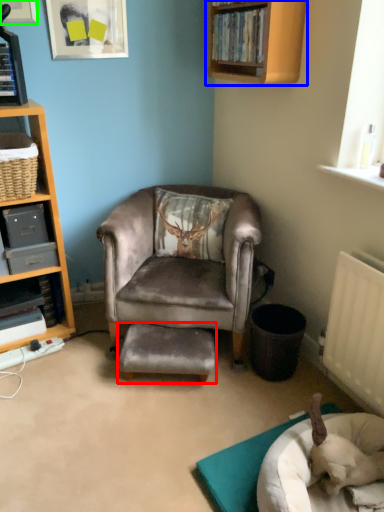
Question: Which object is positioned farthest from stool (highlighted by a red box)? Select from shelf (highlighted by a blue box) and shelf in the corner of a room with a picture frame on the wall (highlighted by a green box).

Choices:
 (A) shelf
 (B) shelf in the corner of a room with a picture frame on the wall

Answer: (B)